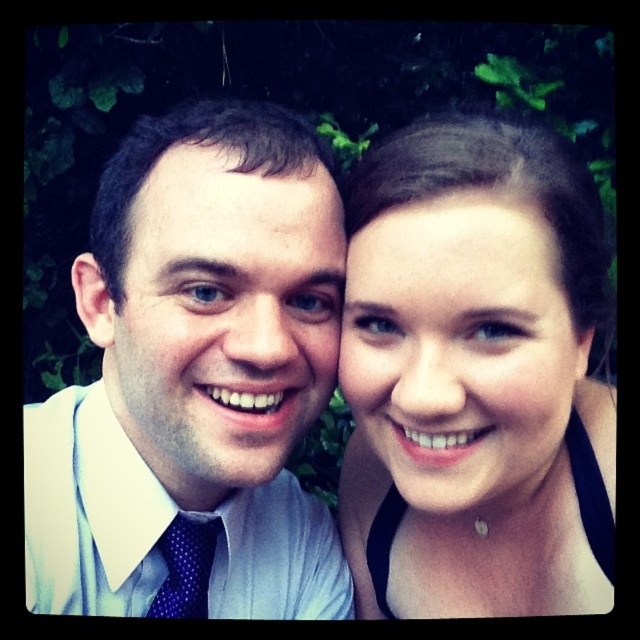
You are a photographer adjusting the lighting for a portrait. You notice the matte skin at center and the blue dotted tie at lower left in your viewfinder. Which object is located to the right of the other?

The matte skin at center is positioned on the right side of blue dotted tie at lower left.